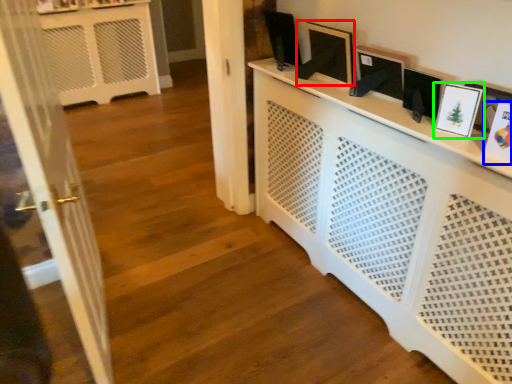
Question: Which object is the closest to the picture frame (highlighted by a red box)? Choose among these: picture frame (highlighted by a blue box) or picture frame (highlighted by a green box).

Choices:
 (A) picture frame
 (B) picture frame

Answer: (B)